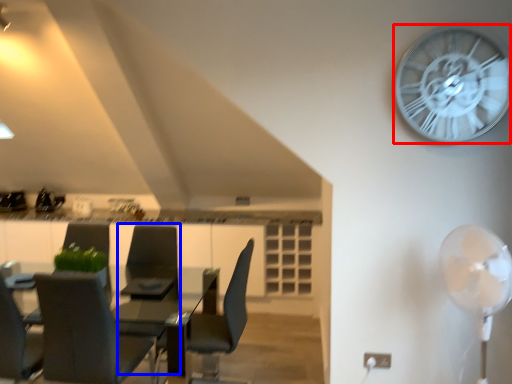
Question: Among these objects, which one is nearest to the camera, wall clock (highlighted by a red box) or armchair (highlighted by a blue box)?

Choices:
 (A) wall clock
 (B) armchair

Answer: (A)